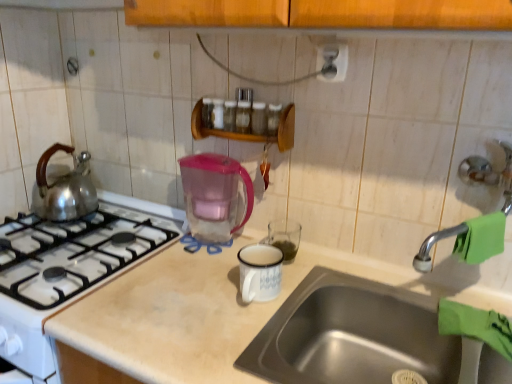
Where is `satin silver outlet at upper center`? Image resolution: width=512 pixels, height=384 pixels. satin silver outlet at upper center is located at coordinates coord(333,62).

Locate an element on the screen. stainless steel sink at lower right is located at coordinates pyautogui.click(x=352, y=335).

Looking at their sizes, would you say transparent plastic pitcher at center is wider or thinner than green rubber faucet at right?

In the image, transparent plastic pitcher at center appears to be wider than green rubber faucet at right.

Would you say transparent plastic pitcher at center is outside green rubber faucet at right?

transparent plastic pitcher at center lies outside green rubber faucet at right's area.

From the picture: Is transparent plastic pitcher at center facing towards green rubber faucet at right?

No.

Who is smaller, transparent plastic pitcher at center or green rubber faucet at right?

green rubber faucet at right is smaller.

From the image's perspective, is satin silver outlet at upper center under transparent plastic pitcher at center?

Actually, satin silver outlet at upper center appears above transparent plastic pitcher at center in the image.

Is satin silver outlet at upper center smaller than transparent plastic pitcher at center?

Yes.

Is satin silver outlet at upper center closer to camera compared to transparent plastic pitcher at center?

Yes, the depth of satin silver outlet at upper center is less than that of transparent plastic pitcher at center.

Between green rubber faucet at right and wooden spice rack at upper center, which one appears on the left side from the viewer's perspective?

wooden spice rack at upper center is more to the left.

Is green rubber faucet at right shorter than wooden spice rack at upper center?

Yes, green rubber faucet at right is shorter than wooden spice rack at upper center.

Is green rubber faucet at right touching wooden spice rack at upper center?

green rubber faucet at right is not next to wooden spice rack at upper center, and they're not touching.

Can you confirm if satin silver outlet at upper center is bigger than wooden spice rack at upper center?

No, satin silver outlet at upper center is not bigger than wooden spice rack at upper center.

Based on the photo, from a real-world perspective, does satin silver outlet at upper center stand above wooden spice rack at upper center?

Yes.

At what (x,y) coordinates should I click in order to perform the action: click on shelf on the left of satin silver outlet at upper center. Please return your answer as a coordinate pair (x, y). The width and height of the screenshot is (512, 384). Looking at the image, I should click on (249, 133).

Which of these two, satin silver outlet at upper center or wooden spice rack at upper center, is wider?

Wider between the two is wooden spice rack at upper center.

From the image's perspective, which is below, wooden spice rack at upper center or stainless steel sink at lower right?

stainless steel sink at lower right is shown below in the image.

From a real-world perspective, between wooden spice rack at upper center and stainless steel sink at lower right, who is vertically lower?

stainless steel sink at lower right.

Identify the location of sink on the right of wooden spice rack at upper center. (352, 335).

Based on the photo, is wooden spice rack at upper center at the left side of stainless steel sink at lower right?

Correct, you'll find wooden spice rack at upper center to the left of stainless steel sink at lower right.

Is point (510, 207) positioned in front of point (246, 184)?

Yes, it is in front of point (246, 184).

Visually, is green rubber faucet at right positioned to the left or to the right of transparent plastic pitcher at center?

green rubber faucet at right is positioned on transparent plastic pitcher at center's right side.

Does green rubber faucet at right lie in front of transparent plastic pitcher at center?

Yes, green rubber faucet at right is closer to the camera.

From the image's perspective, does wooden spice rack at upper center appear higher than green rubber faucet at right?

Yes, from the image's perspective, wooden spice rack at upper center is above green rubber faucet at right.

Is wooden spice rack at upper center looking in the opposite direction of green rubber faucet at right?

That's not correct — wooden spice rack at upper center is not looking away from green rubber faucet at right.

Relative to green rubber faucet at right, is wooden spice rack at upper center in front or behind?

wooden spice rack at upper center is positioned farther from the viewer than green rubber faucet at right.

Can you confirm if wooden spice rack at upper center is smaller than green rubber faucet at right?

No, wooden spice rack at upper center is not smaller than green rubber faucet at right.

You are a GUI agent. You are given a task and a screenshot of the screen. Output one action in this format:
    pyautogui.click(x=<x>, y=<y>)
    Task: Click on the faucet on the right of transparent plastic pitcher at center
    Image resolution: width=512 pixels, height=384 pixels.
    Given the screenshot: What is the action you would take?
    pyautogui.click(x=432, y=245)

I want to click on electric outlet in front of the transparent plastic pitcher at center, so click(333, 62).

Which object lies further to the anchor point green rubber faucet at right, satin silver outlet at upper center or stainless steel sink at lower right?

Based on the image, satin silver outlet at upper center appears to be further to green rubber faucet at right.

When comparing their distances from satin silver outlet at upper center, does green rubber faucet at right or transparent plastic pitcher at center seem closer?

Based on the image, transparent plastic pitcher at center appears to be nearer to satin silver outlet at upper center.

Looking at the image, which one is located further to satin silver outlet at upper center, transparent plastic pitcher at center or green rubber faucet at right?

green rubber faucet at right lies further to satin silver outlet at upper center than the other object.

Based on their spatial positions, is stainless steel sink at lower right or green rubber faucet at right further from transparent plastic pitcher at center?

green rubber faucet at right is further to transparent plastic pitcher at center.

Considering their positions, is satin silver outlet at upper center positioned closer to wooden spice rack at upper center than transparent plastic pitcher at center?

transparent plastic pitcher at center is positioned closer to the anchor wooden spice rack at upper center.

Based on their spatial positions, is stainless steel sink at lower right or wooden spice rack at upper center closer to green rubber faucet at right?

The object closer to green rubber faucet at right is stainless steel sink at lower right.

When comparing their distances from transparent plastic pitcher at center, does wooden spice rack at upper center or stainless steel sink at lower right seem further?

stainless steel sink at lower right is positioned further to the anchor transparent plastic pitcher at center.

Which object lies nearer to the anchor point wooden spice rack at upper center, satin silver outlet at upper center or stainless steel sink at lower right?

satin silver outlet at upper center is positioned closer to the anchor wooden spice rack at upper center.

You are a GUI agent. You are given a task and a screenshot of the screen. Output one action in this format:
    pyautogui.click(x=<x>, y=<y>)
    Task: Click on the sink located between transparent plastic pitcher at center and green rubber faucet at right in the left-right direction
    This screenshot has width=512, height=384.
    Given the screenshot: What is the action you would take?
    pyautogui.click(x=352, y=335)

Where is `faucet between satin silver outlet at upper center and stainless steel sink at lower right vertically`? faucet between satin silver outlet at upper center and stainless steel sink at lower right vertically is located at coordinates (432, 245).

Where is `faucet between wooden spice rack at upper center and stainless steel sink at lower right in the vertical direction`? The height and width of the screenshot is (384, 512). faucet between wooden spice rack at upper center and stainless steel sink at lower right in the vertical direction is located at coordinates click(432, 245).

I want to click on electric outlet between wooden spice rack at upper center and green rubber faucet at right in the horizontal direction, so click(333, 62).